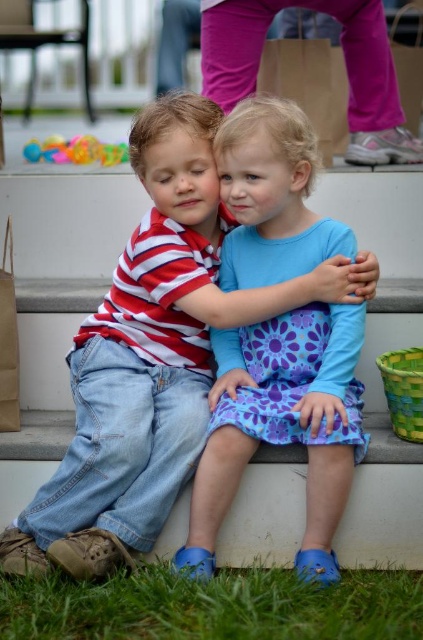
Based on the photo, you are a photographer trying to capture a candid shot of the children without them noticing. You want to position your camera so that the translucent plastic toys at upper left are visible in the background while keeping the blue cotton dress at center in the foreground. Is this possible given their positions?

Yes, because the blue cotton dress at center is below the translucent plastic toys at upper left, positioning the camera to include both the foreground dress and the background toys is feasible.

You are a photographer trying to capture a closeup of the boy in the striped shirt. You notice two points marked in the image. The first point is at coordinate point (43, 624) and the second is at point (112, 145). Which point should you focus on to ensure the boy is in focus?

Point (43, 624) is closer to the camera than point (112, 145), so focusing on point (43, 624) will ensure the boy in the striped shirt is in focus.

You are a photographer planning to take a photo of the two children sitting on the steps. You want to ensure both the blue cotton dress at center and the pink fabric pants at upper center are clearly visible in the shot. Based on their positions, which clothing item is closer to the camera?

The blue cotton dress at center is closer to the camera because it is in front of the pink fabric pants at upper center.